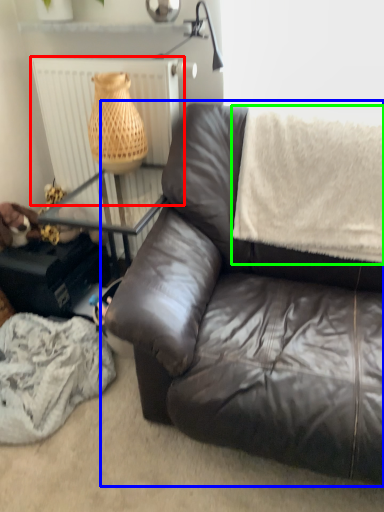
Question: Estimate the real-world distances between objects in this image. Which object is closer to radiator (highlighted by a red box), studio couch (highlighted by a blue box) or blanket (highlighted by a green box)?

Choices:
 (A) studio couch
 (B) blanket

Answer: (B)